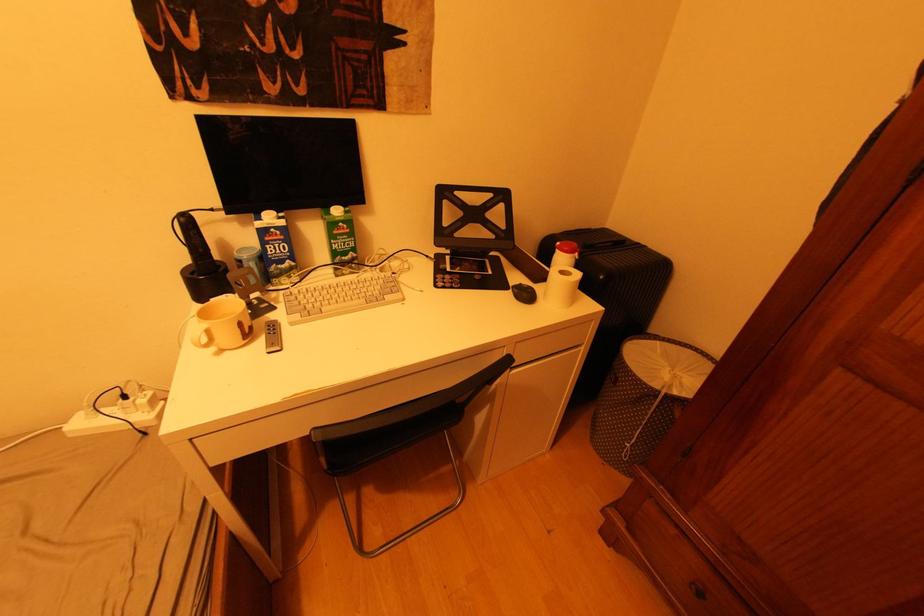
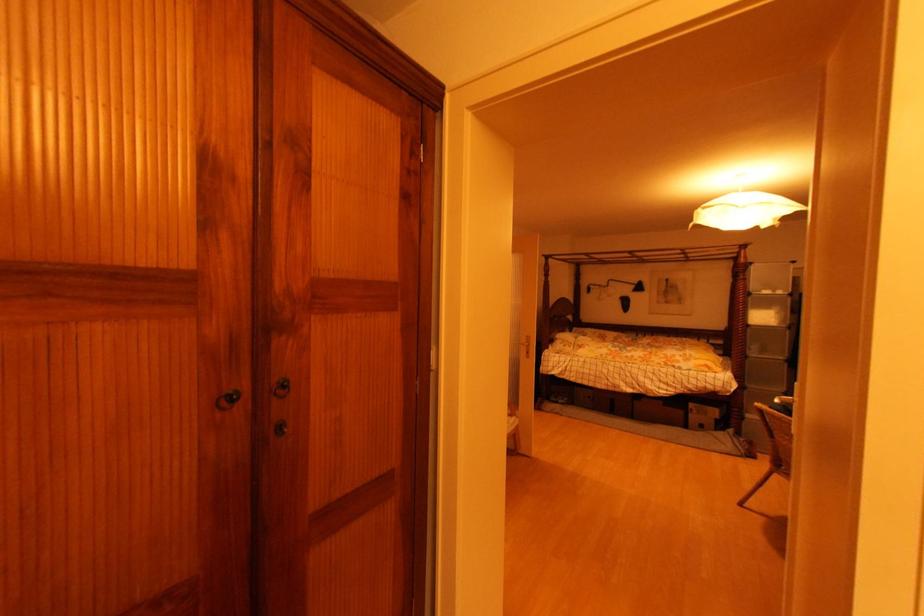
Based on the photo, the first image is from the beginning of the video and the second image is from the end. How did the camera likely rotate when shooting the video?

The rotation direction of the camera is right-down.